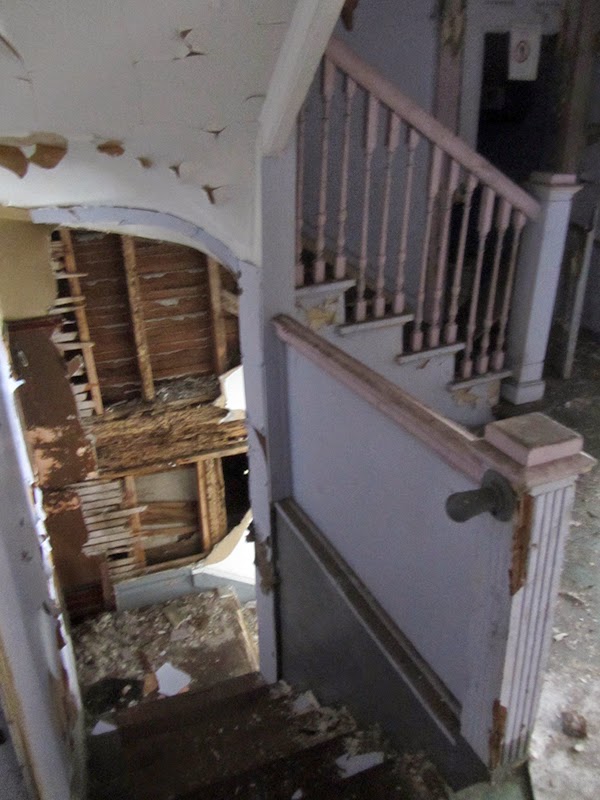
Identify the location of wall. The image size is (600, 800). (407, 525).